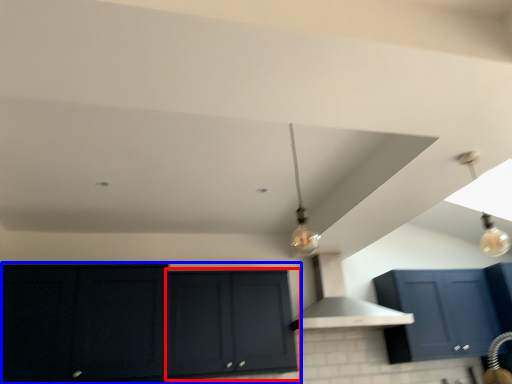
Question: Among these objects, which one is farthest to the camera, cabinetry (highlighted by a red box) or cabinetry (highlighted by a blue box)?

Choices:
 (A) cabinetry
 (B) cabinetry

Answer: (A)